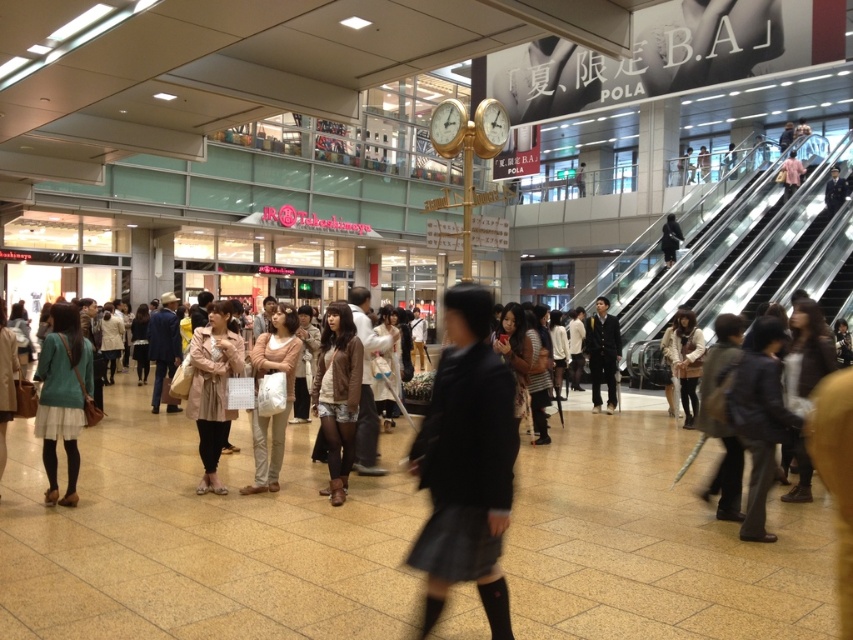
Question: Which object is closer to the camera taking this photo?

Choices:
 (A) teal fabric skirt at lower left
 (B) leather jacket at center
 (C) black fabric coat at center

Answer: (A)

Question: Does teal fabric skirt at lower left have a smaller size compared to brown leather jacket at center?

Choices:
 (A) yes
 (B) no

Answer: (B)

Question: Among these points, which one is nearest to the camera?

Choices:
 (A) (274, 474)
 (B) (457, 531)
 (C) (352, 438)

Answer: (B)

Question: Which point is farther to the camera?

Choices:
 (A) teal fabric skirt at lower left
 (B) leather jacket at center
 (C) black matte jacket at center

Answer: (C)

Question: Is dark gray skirt at center below brown leather jacket at center?

Choices:
 (A) no
 (B) yes

Answer: (A)

Question: Considering the relative positions of teal fabric skirt at lower left and light beige textured coat at center in the image provided, where is teal fabric skirt at lower left located with respect to light beige textured coat at center?

Choices:
 (A) left
 (B) right

Answer: (A)